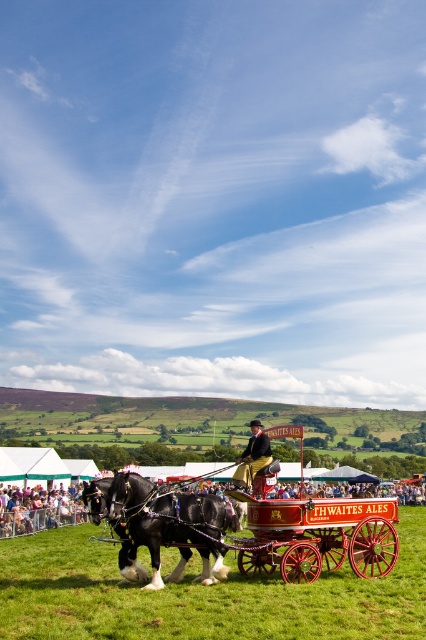
Question: Can you confirm if red polished wood horse cart at center is positioned below smooth brown leather jacket at center?

Choices:
 (A) no
 (B) yes

Answer: (B)

Question: Which object is farther from the camera taking this photo?

Choices:
 (A) shiny black horse at center
 (B) red polished wood horse cart at center
 (C) smooth skin person at lower left

Answer: (C)

Question: Which point is closer to the camera taking this photo?

Choices:
 (A) (32, 536)
 (B) (259, 422)
 (C) (316, 540)
 (D) (11, 499)

Answer: (C)

Question: Observing the image, what is the correct spatial positioning of green grassy field at center in reference to smooth skin person at lower left?

Choices:
 (A) below
 (B) above

Answer: (B)

Question: Which point appears farthest from the camera in this image?

Choices:
 (A) (238, 563)
 (B) (255, 624)

Answer: (A)

Question: Is green grassy field at center to the left of red polished wood horse cart at center from the viewer's perspective?

Choices:
 (A) no
 (B) yes

Answer: (B)